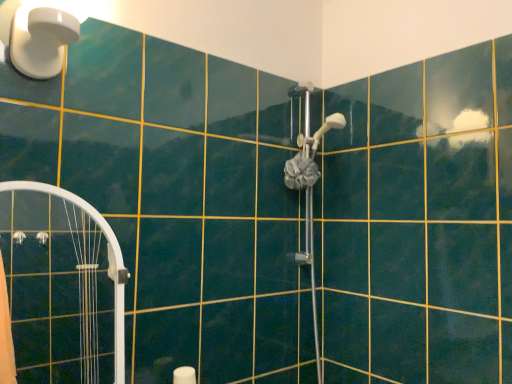
Question: Considering the relative sizes of satin silver shower head at center, positioned as the 2th shower in bottom-to-top order, and white plastic light fixture at upper left in the image provided, is satin silver shower head at center, positioned as the 2th shower in bottom-to-top order, bigger than white plastic light fixture at upper left?

Choices:
 (A) no
 (B) yes

Answer: (A)

Question: Considering the relative sizes of satin silver shower head at center, positioned as the 2th shower in bottom-to-top order, and white plastic light fixture at upper left in the image provided, is satin silver shower head at center, positioned as the 2th shower in bottom-to-top order, shorter than white plastic light fixture at upper left?

Choices:
 (A) yes
 (B) no

Answer: (A)

Question: Considering the relative positions of satin silver shower head at center, positioned as the 2th shower in bottom-to-top order, and white plastic light fixture at upper left in the image provided, is satin silver shower head at center, positioned as the 2th shower in bottom-to-top order, behind white plastic light fixture at upper left?

Choices:
 (A) yes
 (B) no

Answer: (A)

Question: Is satin silver shower head at center, positioned as the 2th shower in bottom-to-top order, positioned with its back to white plastic light fixture at upper left?

Choices:
 (A) yes
 (B) no

Answer: (B)

Question: Does satin silver shower head at center, positioned as the 2th shower in bottom-to-top order, appear on the right side of white plastic light fixture at upper left?

Choices:
 (A) yes
 (B) no

Answer: (A)

Question: From a real-world perspective, is white glossy shower door at left above or below satin silver shower head at center, positioned as the 2th shower in bottom-to-top order?

Choices:
 (A) above
 (B) below

Answer: (B)

Question: Is white glossy shower door at left inside the boundaries of satin silver shower head at center, positioned as the 1th shower in top-to-bottom order, or outside?

Choices:
 (A) inside
 (B) outside

Answer: (B)

Question: Based on their positions, is white glossy shower door at left located to the left or right of satin silver shower head at center, positioned as the 1th shower in top-to-bottom order?

Choices:
 (A) left
 (B) right

Answer: (A)

Question: Considering their positions, is white glossy shower door at left located in front of or behind satin silver shower head at center, positioned as the 1th shower in top-to-bottom order?

Choices:
 (A) behind
 (B) front

Answer: (B)

Question: Is white plastic light fixture at upper left taller or shorter than white glossy shower door at left?

Choices:
 (A) short
 (B) tall

Answer: (A)

Question: Is white plastic light fixture at upper left inside the boundaries of white glossy shower door at left, or outside?

Choices:
 (A) inside
 (B) outside

Answer: (B)

Question: From a real-world perspective, relative to white glossy shower door at left, is white plastic light fixture at upper left vertically above or below?

Choices:
 (A) below
 (B) above

Answer: (B)

Question: Is white plastic light fixture at upper left to the left or to the right of white glossy shower door at left in the image?

Choices:
 (A) left
 (B) right

Answer: (A)

Question: Is white plastic light fixture at upper left in front of or behind satin silver shower head at center, marked as the second shower in a top-to-bottom arrangement, in the image?

Choices:
 (A) behind
 (B) front

Answer: (B)

Question: From the image's perspective, is white plastic light fixture at upper left located above or below satin silver shower head at center, marked as the first shower in a bottom-to-top arrangement?

Choices:
 (A) above
 (B) below

Answer: (A)